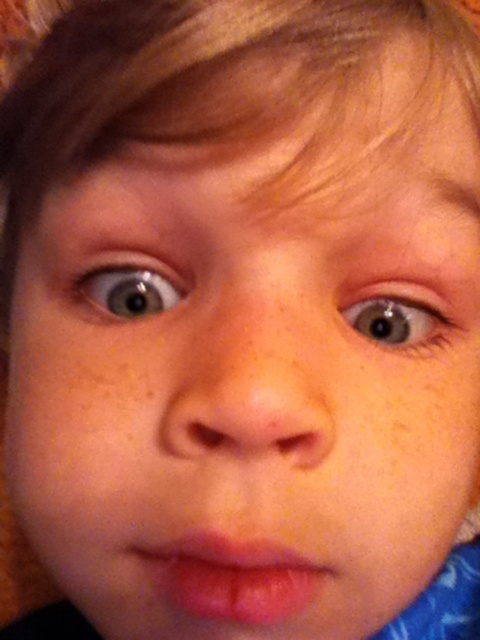
You are a photographer adjusting the focus on a camera. You want to capture the pink glossy lips at center and the blue glossy eye at center clearly. Which object should you focus on first to ensure both are in focus?

The pink glossy lips at center is in front of the blue glossy eye at center. To ensure both are in focus, you should focus on the pink glossy lips at center first, as it is closer to the camera, and then adjust the focus towards the blue glossy eye at center if needed.

You are a photographer holding a camera that has a focal length of 50mm. You are currently positioned such that the point at coordinates point (x=432, y=300) is in your view. If you want to ensure that the point remains in your frame while moving closer by 3 inches, will the point still be visible?

The point at coordinates point (x=432, y=300) and the viewer are 9.86 inches apart. Moving closer by 3 inches would reduce the distance to 6.86 inches. Since the focal length of 50mm is fixed, the field of view remains constant. Therefore, the point will still be visible as it remains within the camera frame.

You are an artist trying to draw the child in the image. You notice two glossy elements in the center of the face. Which one should you make larger in your drawing, the pink glossy lips at center or the blue glossy eye at center?

The pink glossy lips at center should be made larger in the drawing since it is bigger than the blue glossy eye at center according to the description.